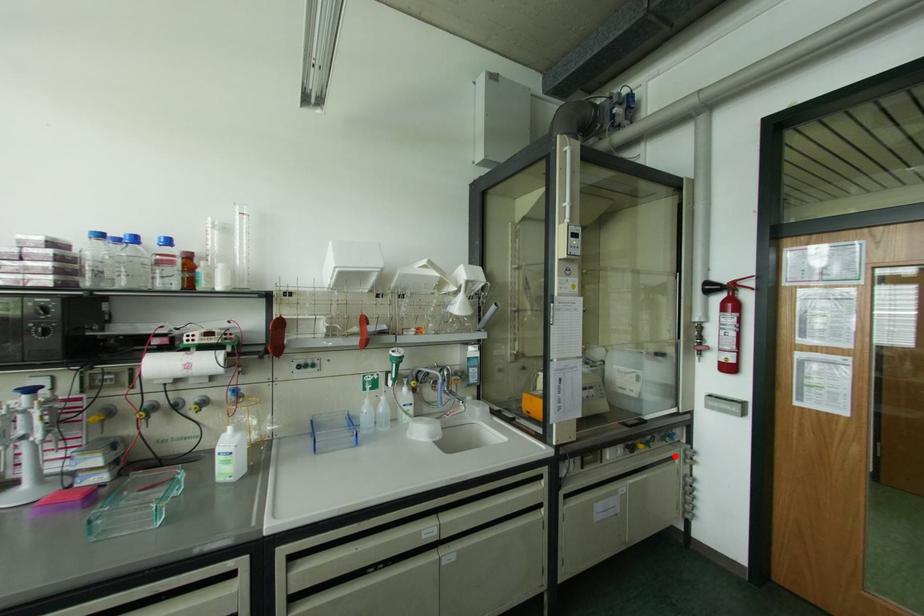
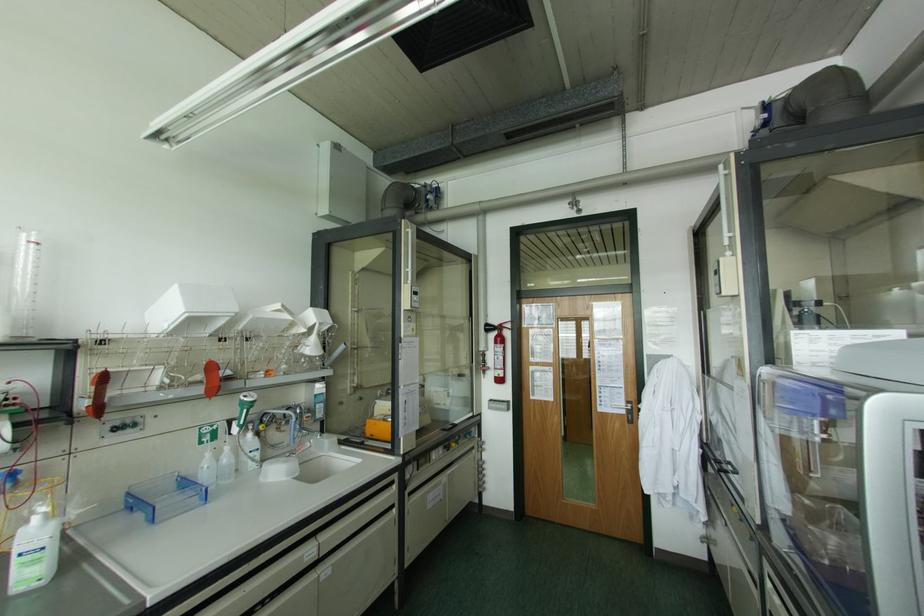
Question: I am providing you with two images of the same scene from different viewpoints. Given a red point in image1, look at the same physical point in image2. Is it:

Choices:
 (A) Closer to the viewpoint
 (B) Farther from the viewpoint

Answer: (B)